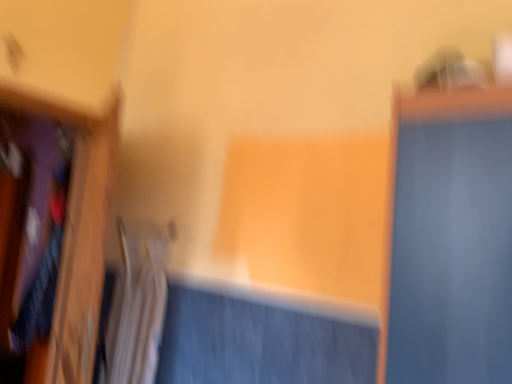
Describe the element at coordinates (136, 307) in the screenshot. I see `white fabric radiator at lower left` at that location.

The height and width of the screenshot is (384, 512). I want to click on white fabric radiator at lower left, so click(x=136, y=307).

This screenshot has width=512, height=384. I want to click on velvet-like fabric shirt at left, so click(x=42, y=277).

You are a GUI agent. You are given a task and a screenshot of the screen. Output one action in this format:
    pyautogui.click(x=<x>, y=<y>)
    Task: Click on the white fabric radiator at lower left
    The width and height of the screenshot is (512, 384).
    Given the screenshot: What is the action you would take?
    pyautogui.click(x=136, y=307)

Who is taller, velvet-like fabric shirt at left or white fabric radiator at lower left?

Standing taller between the two is velvet-like fabric shirt at left.

Is velvet-like fabric shirt at left to the right of white fabric radiator at lower left from the viewer's perspective?

No.

Who is bigger, velvet-like fabric shirt at left or white fabric radiator at lower left?

With larger size is velvet-like fabric shirt at left.

Based on the photo, from the image's perspective, relative to velvet-like fabric shirt at left, is wooden frame at left above or below?

From the image's perspective, wooden frame at left appears above velvet-like fabric shirt at left.

Considering the relative sizes of wooden frame at left and velvet-like fabric shirt at left in the image provided, is wooden frame at left shorter than velvet-like fabric shirt at left?

In fact, wooden frame at left may be taller than velvet-like fabric shirt at left.

Looking at this image, would you say wooden frame at left is inside or outside velvet-like fabric shirt at left?

wooden frame at left lies outside velvet-like fabric shirt at left.

Does point (78, 351) come behind point (62, 172)?

No, (78, 351) is in front of (62, 172).

In the image, is white fabric radiator at lower left positioned in front of or behind velvet-like fabric shirt at left?

Visually, white fabric radiator at lower left is located in front of velvet-like fabric shirt at left.

Which is more to the right, white fabric radiator at lower left or velvet-like fabric shirt at left?

white fabric radiator at lower left.

Considering the points (49, 203) and (37, 195), which point is behind, point (49, 203) or point (37, 195)?

The point (37, 195) is more distant.

In the scene shown: Considering the positions of objects velvet-like fabric shirt at left and wooden frame at left in the image provided, who is more to the left, velvet-like fabric shirt at left or wooden frame at left?

velvet-like fabric shirt at left.

From a real-world perspective, which is physically below, velvet-like fabric shirt at left or wooden frame at left?

From a 3D spatial view, velvet-like fabric shirt at left is below.

Can you confirm if velvet-like fabric shirt at left is bigger than wooden frame at left?

Yes.

Is wooden frame at left turned away from white fabric radiator at lower left?

wooden frame at left is not turned away from white fabric radiator at lower left.

Would you consider wooden frame at left to be distant from white fabric radiator at lower left?

No, wooden frame at left is in close proximity to white fabric radiator at lower left.

Locate an element on the screen. furniture in front of the white fabric radiator at lower left is located at coordinates (54, 241).

Does wooden frame at left have a larger size compared to white fabric radiator at lower left?

Indeed, wooden frame at left has a larger size compared to white fabric radiator at lower left.

Is point (150, 263) behind point (36, 138)?

No.

Considering the relative sizes of white fabric radiator at lower left and wooden frame at left in the image provided, is white fabric radiator at lower left shorter than wooden frame at left?

Yes.

Is white fabric radiator at lower left not near wooden frame at left?

No, white fabric radiator at lower left is not far away from wooden frame at left.

Identify the location of radiator that is in front of the velvet-like fabric shirt at left. (136, 307).

You are a GUI agent. You are given a task and a screenshot of the screen. Output one action in this format:
    pyautogui.click(x=<x>, y=<y>)
    Task: Click on the clothing behind the wooden frame at left
    This screenshot has width=512, height=384.
    Given the screenshot: What is the action you would take?
    pyautogui.click(x=42, y=277)

Based on their spatial positions, is wooden frame at left or velvet-like fabric shirt at left closer to white fabric radiator at lower left?

Based on the image, wooden frame at left appears to be nearer to white fabric radiator at lower left.

Estimate the real-world distances between objects in this image. Which object is further from velvet-like fabric shirt at left, wooden frame at left or white fabric radiator at lower left?

white fabric radiator at lower left lies further to velvet-like fabric shirt at left than the other object.

Considering their positions, is velvet-like fabric shirt at left positioned further to wooden frame at left than white fabric radiator at lower left?

white fabric radiator at lower left.

Considering their positions, is velvet-like fabric shirt at left positioned further to white fabric radiator at lower left than wooden frame at left?

Among the two, velvet-like fabric shirt at left is located further to white fabric radiator at lower left.

Estimate the real-world distances between objects in this image. Which object is further from velvet-like fabric shirt at left, white fabric radiator at lower left or wooden frame at left?

Among the two, white fabric radiator at lower left is located further to velvet-like fabric shirt at left.

Based on their spatial positions, is white fabric radiator at lower left or velvet-like fabric shirt at left further from wooden frame at left?

white fabric radiator at lower left lies further to wooden frame at left than the other object.

Identify the location of radiator located between wooden frame at left and velvet-like fabric shirt at left in the depth direction. [136, 307].